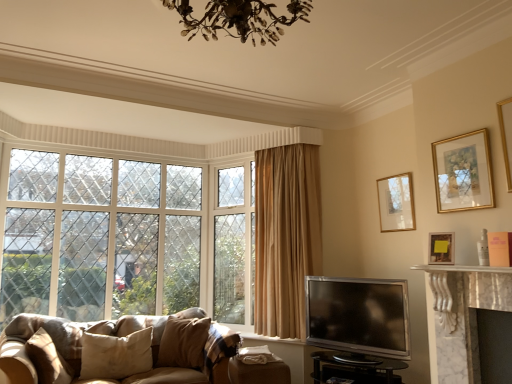
Question: Considering the relative sizes of beige fabric pillow at lower left, the 3th pillow when ordered from right to left, and velvet beige pillow at lower center, which ranks as the first pillow in right-to-left order, in the image provided, is beige fabric pillow at lower left, the 3th pillow when ordered from right to left, smaller than velvet beige pillow at lower center, which ranks as the first pillow in right-to-left order,?

Choices:
 (A) yes
 (B) no

Answer: (A)

Question: Is beige fabric pillow at lower left, acting as the 1th pillow starting from the left, facing towards velvet beige pillow at lower center, which ranks as the first pillow in right-to-left order?

Choices:
 (A) no
 (B) yes

Answer: (B)

Question: Is beige fabric pillow at lower left, acting as the 1th pillow starting from the left, in front of velvet beige pillow at lower center, arranged as the 3th pillow when viewed from the left?

Choices:
 (A) no
 (B) yes

Answer: (B)

Question: Does beige fabric pillow at lower left, acting as the 1th pillow starting from the left, appear on the right side of velvet beige pillow at lower center, arranged as the 3th pillow when viewed from the left?

Choices:
 (A) yes
 (B) no

Answer: (B)

Question: Is beige fabric pillow at lower left, acting as the 1th pillow starting from the left, oriented away from velvet beige pillow at lower center, arranged as the 3th pillow when viewed from the left?

Choices:
 (A) yes
 (B) no

Answer: (B)

Question: Considering the relative positions of wooden picture frame at upper right, the first picture frame when ordered from back to front, and beige fabric pillow at lower left, the 3th pillow when ordered from right to left, in the image provided, is wooden picture frame at upper right, the first picture frame when ordered from back to front, to the left or to the right of beige fabric pillow at lower left, the 3th pillow when ordered from right to left,?

Choices:
 (A) left
 (B) right

Answer: (B)

Question: Relative to beige fabric pillow at lower left, acting as the 1th pillow starting from the left, is wooden picture frame at upper right, the first picture frame when ordered from back to front, in front or behind?

Choices:
 (A) behind
 (B) front

Answer: (A)

Question: Would you say wooden picture frame at upper right, which is the 3th picture frame from front to back, is inside or outside beige fabric pillow at lower left, the 3th pillow when ordered from right to left?

Choices:
 (A) outside
 (B) inside

Answer: (A)

Question: In terms of size, does wooden picture frame at upper right, the first picture frame when ordered from back to front, appear bigger or smaller than beige fabric pillow at lower left, the 3th pillow when ordered from right to left?

Choices:
 (A) big
 (B) small

Answer: (B)

Question: Choose the correct answer: Is beige cotton pillow at lower left, which ranks as the 2th pillow in left-to-right order, inside gold-framed picture at upper right, the 1th picture frame in the front-to-back sequence, or outside it?

Choices:
 (A) inside
 (B) outside

Answer: (B)

Question: Based on their sizes in the image, would you say beige cotton pillow at lower left, which ranks as the 2th pillow in left-to-right order, is bigger or smaller than gold-framed picture at upper right, the 1th picture frame in the front-to-back sequence?

Choices:
 (A) big
 (B) small

Answer: (A)

Question: Is beige cotton pillow at lower left, which ranks as the 2th pillow in left-to-right order, to the left or to the right of gold-framed picture at upper right, marked as the third picture frame in a back-to-front arrangement, in the image?

Choices:
 (A) right
 (B) left

Answer: (B)

Question: In terms of height, does beige cotton pillow at lower left, arranged as the second pillow when viewed from the right, look taller or shorter compared to gold-framed picture at upper right, marked as the third picture frame in a back-to-front arrangement?

Choices:
 (A) tall
 (B) short

Answer: (B)

Question: Would you say silver metallic tv at lower right is to the left or to the right of black glass tv stand at lower center in the picture?

Choices:
 (A) left
 (B) right

Answer: (A)

Question: Based on their sizes in the image, would you say silver metallic tv at lower right is bigger or smaller than black glass tv stand at lower center?

Choices:
 (A) small
 (B) big

Answer: (A)